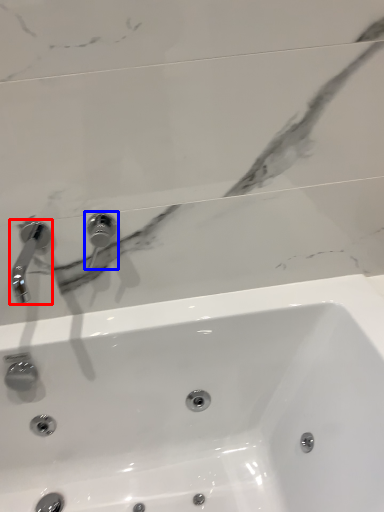
Question: Which object appears closest to the camera in this image, tap (highlighted by a red box) or tap (highlighted by a blue box)?

Choices:
 (A) tap
 (B) tap

Answer: (A)